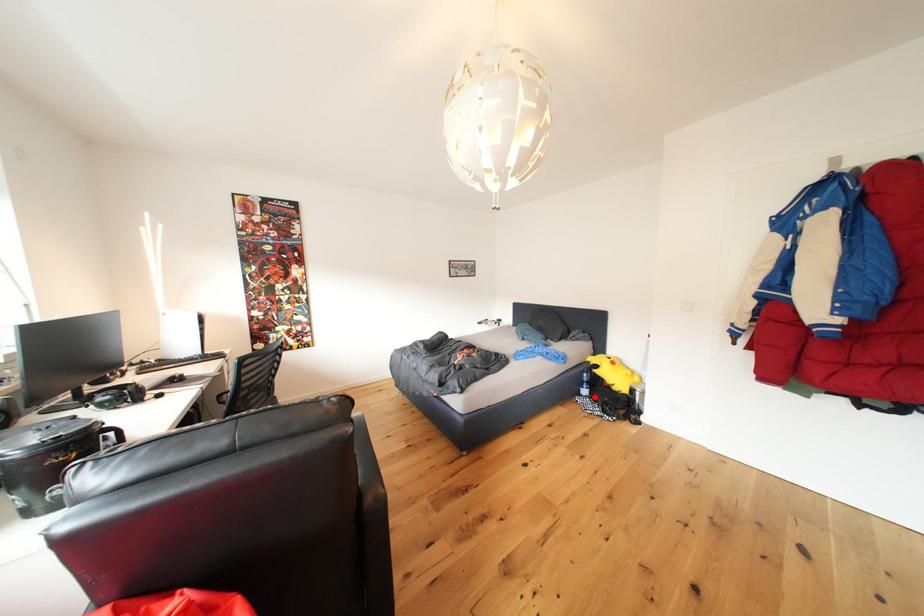
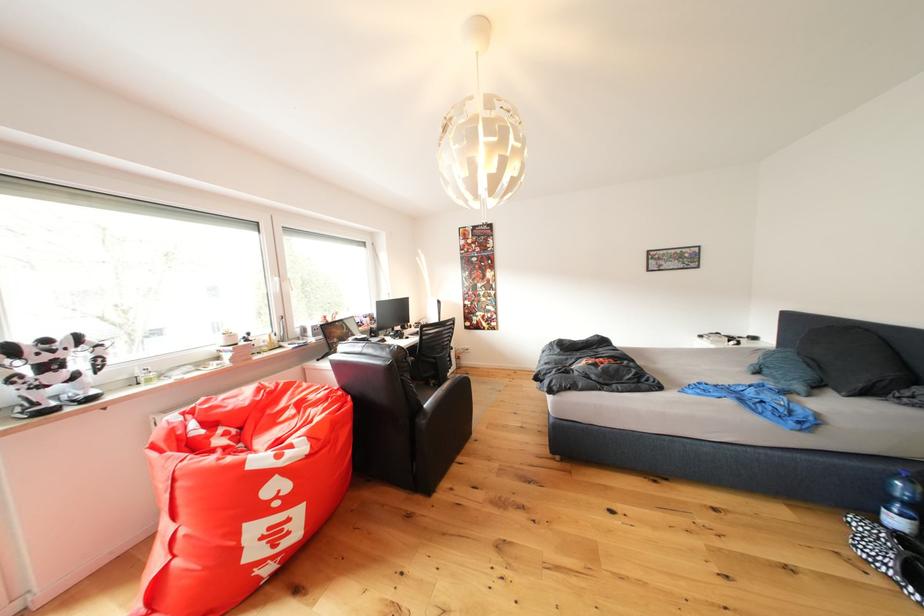
Find the pixel in the second image that matches the highlighted location in the first image.

(906, 527)